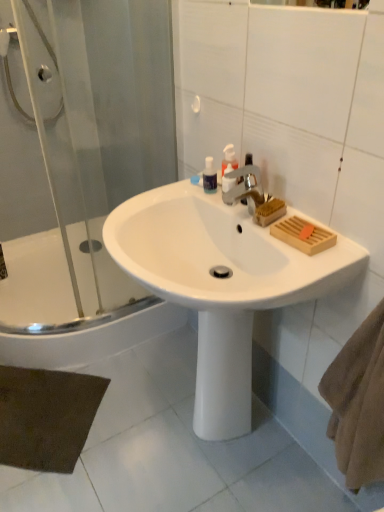
Image resolution: width=384 pixels, height=512 pixels. In order to click on vacant region above brown felt bath mat at lower left (from a real-world perspective) in this screenshot , I will do `click(38, 410)`.